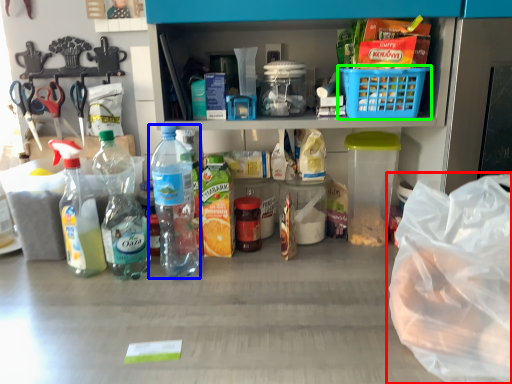
Question: Considering the real-world distances, which object is closest to plastic bag (highlighted by a red box)? bottle (highlighted by a blue box) or basket (highlighted by a green box).

Choices:
 (A) bottle
 (B) basket

Answer: (B)